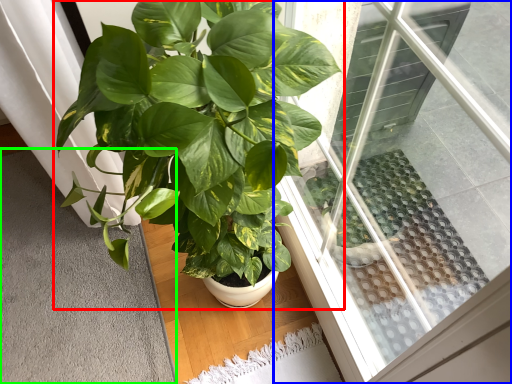
Question: Which object is the farthest from houseplant (highlighted by a red box)? Choose among these: window (highlighted by a blue box) or gray (highlighted by a green box).

Choices:
 (A) window
 (B) gray

Answer: (B)